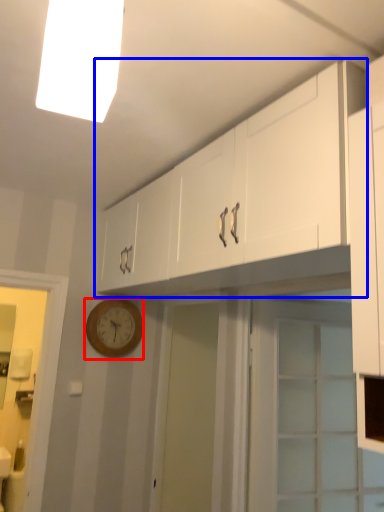
Question: Which point is closer to the camera, wall clock (highlighted by a red box) or cabinetry (highlighted by a blue box)?

Choices:
 (A) wall clock
 (B) cabinetry

Answer: (B)